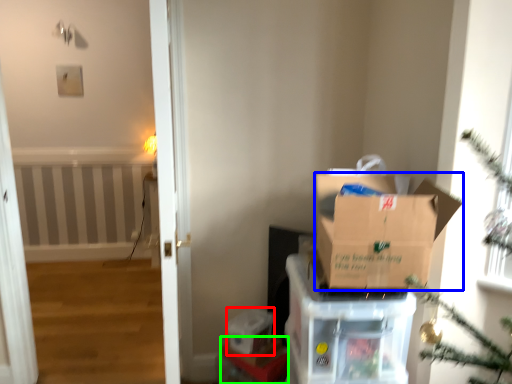
Question: Based on their relative distances, which object is nearer to storage box (highlighted by a red box)? Choose from box (highlighted by a blue box) and furniture (highlighted by a green box).

Choices:
 (A) box
 (B) furniture

Answer: (B)